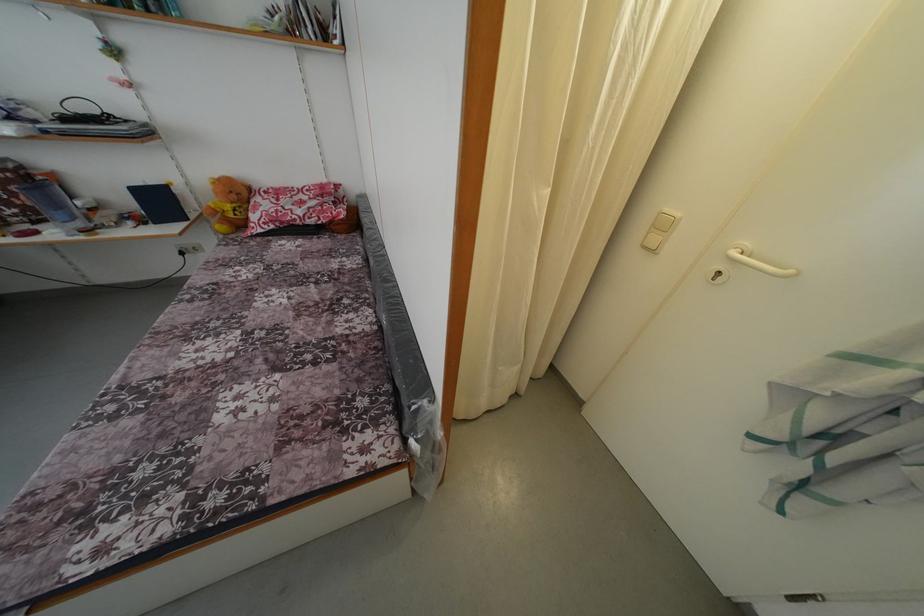
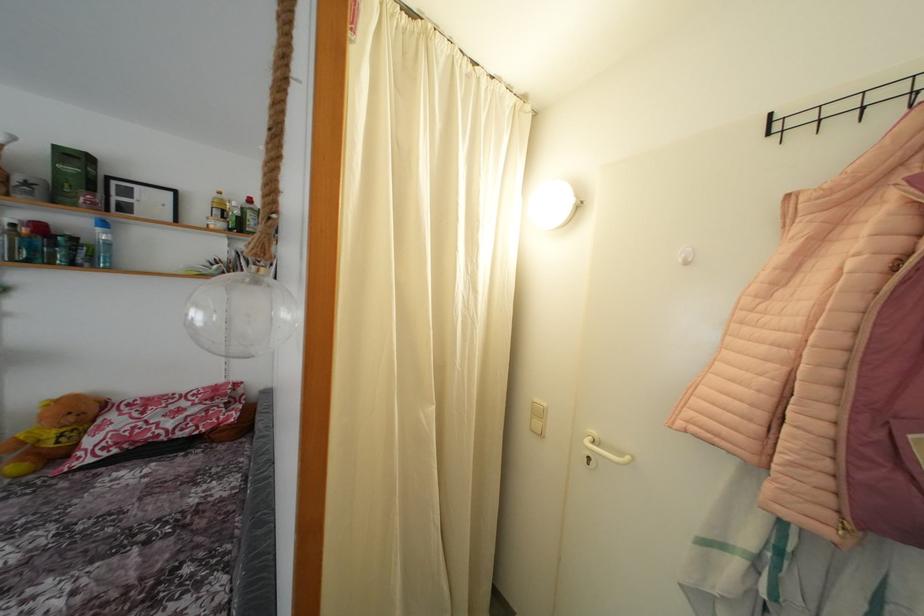
Find the pixel in the second image that matches pixel 348 49 in the first image.

(281, 286)